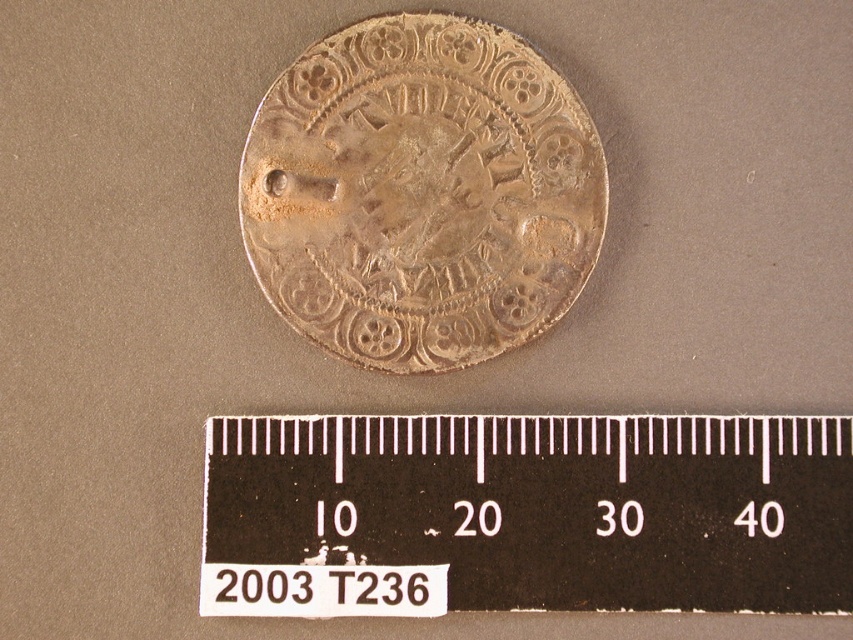
Question: Can you confirm if black plastic ruler at center is positioned below gold-toned metallic coin at center?

Choices:
 (A) yes
 (B) no

Answer: (A)

Question: Among these points, which one is nearest to the camera?

Choices:
 (A) (489, 540)
 (B) (326, 168)

Answer: (B)

Question: Which of the following is the closest to the observer?

Choices:
 (A) black plastic ruler at center
 (B) gold-toned metallic coin at center

Answer: (A)

Question: Is black plastic ruler at center closer to the viewer compared to gold-toned metallic coin at center?

Choices:
 (A) no
 (B) yes

Answer: (B)

Question: Is black plastic ruler at center above gold-toned metallic coin at center?

Choices:
 (A) yes
 (B) no

Answer: (B)

Question: Which of the following is the farthest from the observer?

Choices:
 (A) (369, 33)
 (B) (241, 426)

Answer: (B)